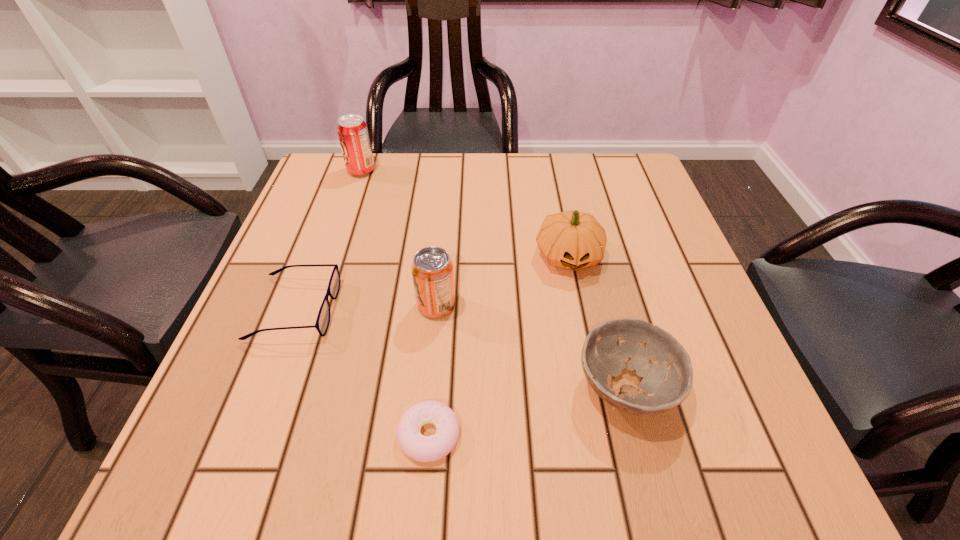
This screenshot has height=540, width=960. Identify the location of free location located on the back of the bowl. (x=582, y=218).

What are the coordinates of `vacant space located on the front-facing side of the fifth tallest object` in the screenshot? It's located at (430, 308).

At what (x,y) coordinates should I click in order to perform the action: click on vacant space located 0.140m on the left of the shortest object. Please return your answer as a coordinate pair (x, y). Looking at the image, I should click on (305, 435).

Find the location of `object that is at the far edge`. object that is at the far edge is located at coordinates (353, 134).

Locate an element on the screen. The image size is (960, 540). bowl that is positioned at the near edge is located at coordinates (667, 383).

Find the location of `doughnut that is at the near edge`. doughnut that is at the near edge is located at coordinates (421, 448).

You are a GUI agent. You are given a task and a screenshot of the screen. Output one action in this format:
    pyautogui.click(x=<x>, y=<y>)
    Task: Click on the soda that is at the left edge
    This screenshot has height=540, width=960.
    Given the screenshot: What is the action you would take?
    pyautogui.click(x=353, y=134)

This screenshot has width=960, height=540. Find the location of `spectacles at the left edge`. spectacles at the left edge is located at coordinates (323, 319).

This screenshot has height=540, width=960. Identify the location of object present at the right edge. (667, 383).

Identify the location of object that is at the far left corner. The width and height of the screenshot is (960, 540). (353, 134).